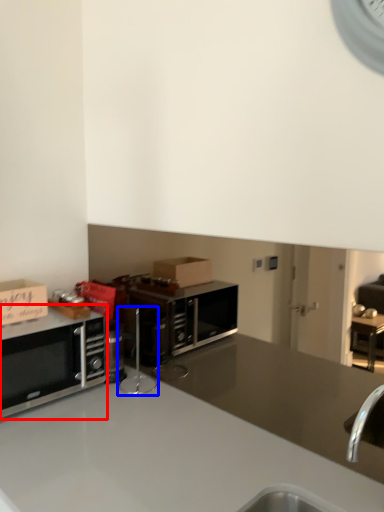
Question: Which of the following is the farthest to the observer, microwave oven (highlighted by a red box) or appliance (highlighted by a blue box)?

Choices:
 (A) microwave oven
 (B) appliance

Answer: (B)